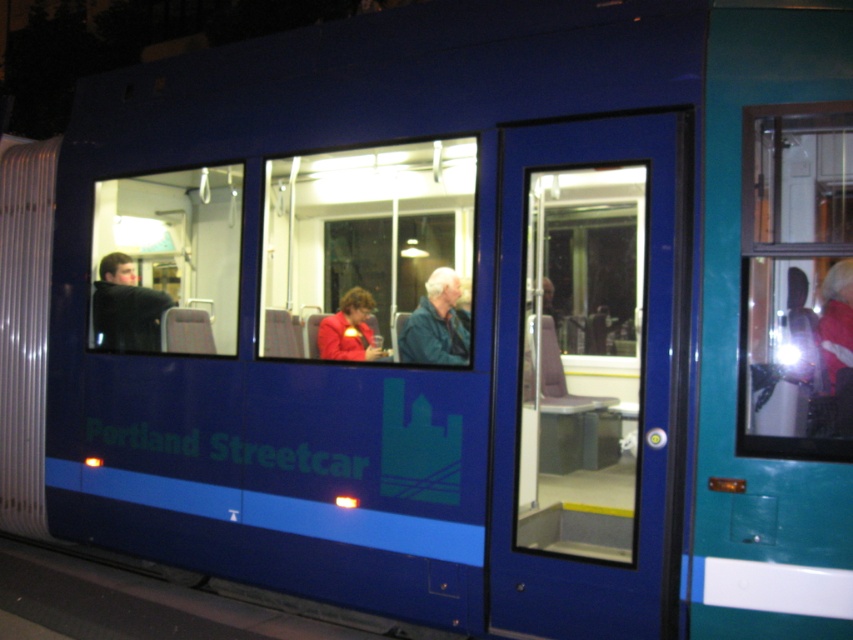
You are standing at point [390,243] and want to walk to the streetcar doors. There is an obstacle at point [541,384]. Can you safely walk around the obstacle to reach the doors?

Point [541,384] is in front of point [390,243], so you can walk around the obstacle by moving to the side of the obstacle to reach the streetcar doors safely.

Based on the photo, you are a passenger on the Portland Streetcar and want to look outside through the transparent glass window at center right while sitting on the matte red jacket at center. Is the window directly above your seat?

The transparent glass window at center right is positioned over the matte red jacket at center, so yes, the window is directly above your seat.